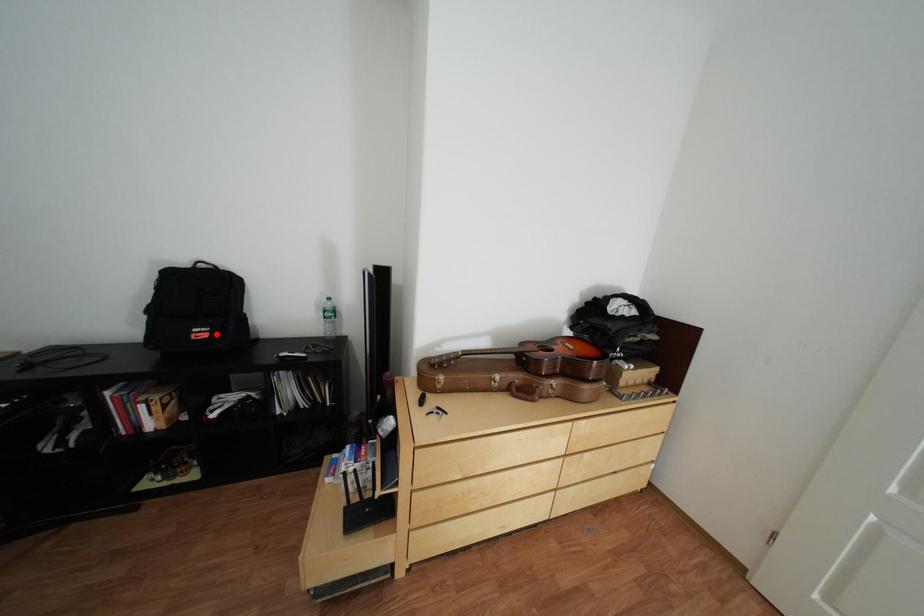
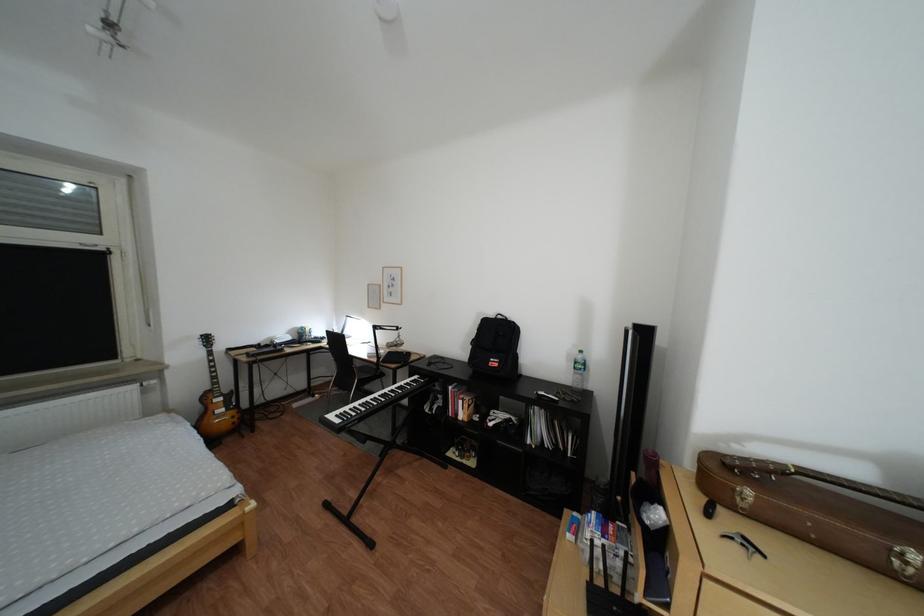
Where in the second image is the point corresponding to the highlighted location from the first image?

(509, 363)